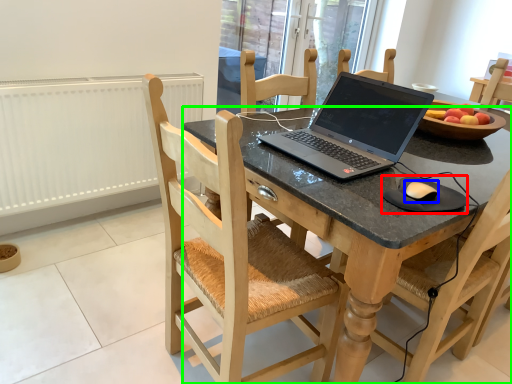
Question: Considering the real-world distances, which object is farthest from mousepad (highlighted by a red box)? mouse (highlighted by a blue box) or desk (highlighted by a green box)?

Choices:
 (A) mouse
 (B) desk

Answer: (B)